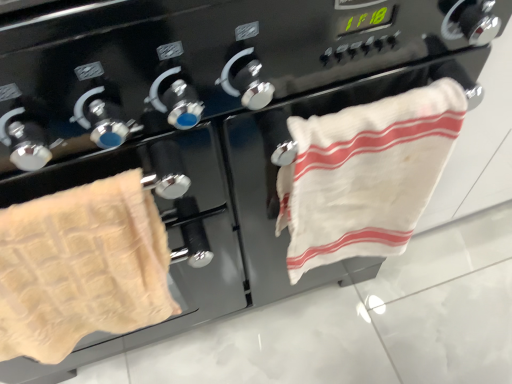
Describe the element at coordinates (81, 267) in the screenshot. I see `beige waffle towel at left, which is the first towel in left-to-right order` at that location.

The width and height of the screenshot is (512, 384). I want to click on beige waffle towel at left, which is the first towel in left-to-right order, so click(81, 267).

At what (x,y) coordinates should I click in order to perform the action: click on white cotton towel at right, which is counted as the 2th towel, starting from the left. Please return your answer as a coordinate pair (x, y). This screenshot has height=384, width=512. Looking at the image, I should click on pos(365,175).

Describe the element at coordinates (365, 175) in the screenshot. The width and height of the screenshot is (512, 384). I see `white cotton towel at right, which is the first towel from right to left` at that location.

In order to face white cotton towel at right, which is counted as the 2th towel, starting from the left, should I rotate leftwards or rightwards?

You should look right and rotate roughly 14.169 degrees.

What is the approximate width of white cotton towel at right, which is the first towel from right to left?

It is 3.47 inches.

This screenshot has width=512, height=384. What are the coordinates of `beige waffle towel at left, which is the first towel in left-to-right order` in the screenshot? It's located at (81, 267).

Is beige waffle towel at left, acting as the 2th towel starting from the right, to the right of white cotton towel at right, which is the first towel from right to left, from the viewer's perspective?

Incorrect, beige waffle towel at left, acting as the 2th towel starting from the right, is not on the right side of white cotton towel at right, which is the first towel from right to left.

Considering the positions of objects beige waffle towel at left, acting as the 2th towel starting from the right, and white cotton towel at right, which is counted as the 2th towel, starting from the left, in the image provided, who is behind, beige waffle towel at left, acting as the 2th towel starting from the right, or white cotton towel at right, which is counted as the 2th towel, starting from the left,?

white cotton towel at right, which is counted as the 2th towel, starting from the left, is further from the camera.

Which is further, [63,298] or [367,191]?

Point [367,191]

From the image's perspective, does beige waffle towel at left, which is the first towel in left-to-right order, appear lower than white cotton towel at right, which is the first towel from right to left?

Correct, beige waffle towel at left, which is the first towel in left-to-right order, appears lower than white cotton towel at right, which is the first towel from right to left, in the image.

From a real-world perspective, which object stands above the other?

From a 3D spatial view, beige waffle towel at left, acting as the 2th towel starting from the right, is above.

Does beige waffle towel at left, which is the first towel in left-to-right order, have a lesser width compared to white cotton towel at right, which is counted as the 2th towel, starting from the left?

In fact, beige waffle towel at left, which is the first towel in left-to-right order, might be wider than white cotton towel at right, which is counted as the 2th towel, starting from the left.

From their relative heights in the image, would you say beige waffle towel at left, acting as the 2th towel starting from the right, is taller or shorter than white cotton towel at right, which is the first towel from right to left?

Clearly, beige waffle towel at left, acting as the 2th towel starting from the right, is shorter compared to white cotton towel at right, which is the first towel from right to left.

Does beige waffle towel at left, which is the first towel in left-to-right order, have a smaller size compared to white cotton towel at right, which is counted as the 2th towel, starting from the left?

Actually, beige waffle towel at left, which is the first towel in left-to-right order, might be larger than white cotton towel at right, which is counted as the 2th towel, starting from the left.

Looking at this image, is beige waffle towel at left, acting as the 2th towel starting from the right, not inside white cotton towel at right, which is the first towel from right to left?

Yes.

Can you see beige waffle towel at left, which is the first towel in left-to-right order, touching white cotton towel at right, which is the first towel from right to left?

No, beige waffle towel at left, which is the first towel in left-to-right order, is not next to white cotton towel at right, which is the first towel from right to left.

Is beige waffle towel at left, which is the first towel in left-to-right order, facing towards white cotton towel at right, which is counted as the 2th towel, starting from the left?

No, beige waffle towel at left, which is the first towel in left-to-right order, is not facing towards white cotton towel at right, which is counted as the 2th towel, starting from the left.

This screenshot has width=512, height=384. I want to click on towel located above the beige waffle towel at left, which is the first towel in left-to-right order (from the image's perspective), so click(x=365, y=175).

Considering the relative positions of white cotton towel at right, which is the first towel from right to left, and beige waffle towel at left, which is the first towel in left-to-right order, in the image provided, is white cotton towel at right, which is the first towel from right to left, to the left or to the right of beige waffle towel at left, which is the first towel in left-to-right order,?

white cotton towel at right, which is the first towel from right to left, is positioned on beige waffle towel at left, which is the first towel in left-to-right order,'s right side.

Which object is closer to the camera, white cotton towel at right, which is the first towel from right to left, or beige waffle towel at left, acting as the 2th towel starting from the right?

Positioned in front is beige waffle towel at left, acting as the 2th towel starting from the right.

Looking at this image, which is nearer, (x=372, y=188) or (x=105, y=196)?

The point (x=105, y=196) is closer to the camera.

From the image's perspective, between white cotton towel at right, which is the first towel from right to left, and beige waffle towel at left, which is the first towel in left-to-right order, which one is located above?

From the image's view, white cotton towel at right, which is the first towel from right to left, is above.

From a real-world perspective, does white cotton towel at right, which is counted as the 2th towel, starting from the left, sit lower than beige waffle towel at left, which is the first towel in left-to-right order?

Yes.

Which of these two, white cotton towel at right, which is the first towel from right to left, or beige waffle towel at left, which is the first towel in left-to-right order, is wider?

With larger width is beige waffle towel at left, which is the first towel in left-to-right order.

Between white cotton towel at right, which is the first towel from right to left, and beige waffle towel at left, which is the first towel in left-to-right order, which one has more height?

white cotton towel at right, which is the first towel from right to left, is taller.

Considering the sizes of objects white cotton towel at right, which is the first towel from right to left, and beige waffle towel at left, which is the first towel in left-to-right order, in the image provided, who is bigger, white cotton towel at right, which is the first towel from right to left, or beige waffle towel at left, which is the first towel in left-to-right order,?

beige waffle towel at left, which is the first towel in left-to-right order, is bigger.

Is white cotton towel at right, which is counted as the 2th towel, starting from the left, not inside beige waffle towel at left, which is the first towel in left-to-right order?

white cotton towel at right, which is counted as the 2th towel, starting from the left, lies outside beige waffle towel at left, which is the first towel in left-to-right order,'s area.

Is there a large distance between white cotton towel at right, which is counted as the 2th towel, starting from the left, and beige waffle towel at left, which is the first towel in left-to-right order?

No, white cotton towel at right, which is counted as the 2th towel, starting from the left, is in close proximity to beige waffle towel at left, which is the first towel in left-to-right order.

Is white cotton towel at right, which is the first towel from right to left, oriented away from beige waffle towel at left, acting as the 2th towel starting from the right?

white cotton towel at right, which is the first towel from right to left, is not turned away from beige waffle towel at left, acting as the 2th towel starting from the right.

This screenshot has height=384, width=512. I want to click on towel that is under the beige waffle towel at left, which is the first towel in left-to-right order (from a real-world perspective), so click(365, 175).

Locate an element on the screen. This screenshot has width=512, height=384. towel that is in front of the white cotton towel at right, which is counted as the 2th towel, starting from the left is located at coordinates (81, 267).

Where is `towel that is on the right side of beige waffle towel at left, acting as the 2th towel starting from the right`? The height and width of the screenshot is (384, 512). towel that is on the right side of beige waffle towel at left, acting as the 2th towel starting from the right is located at coordinates point(365,175).